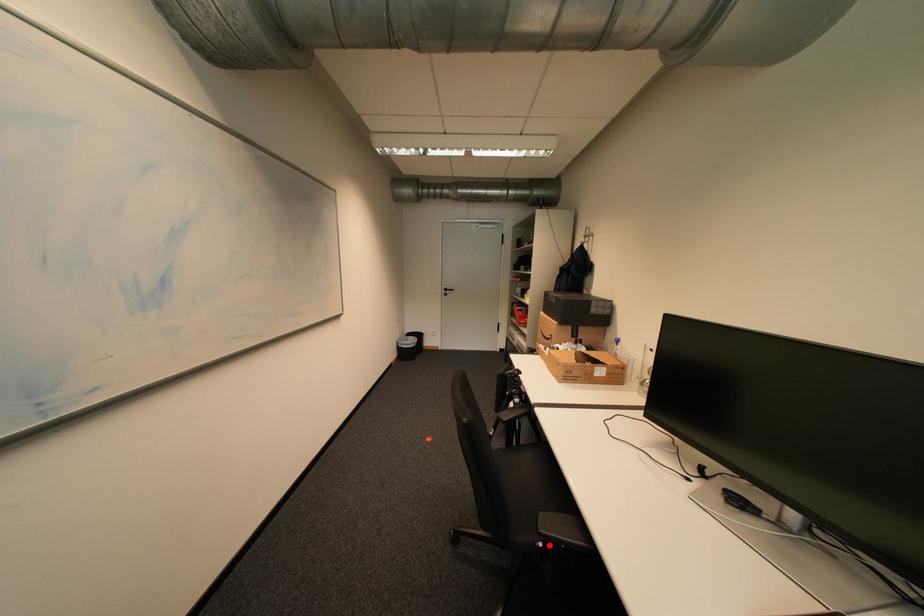
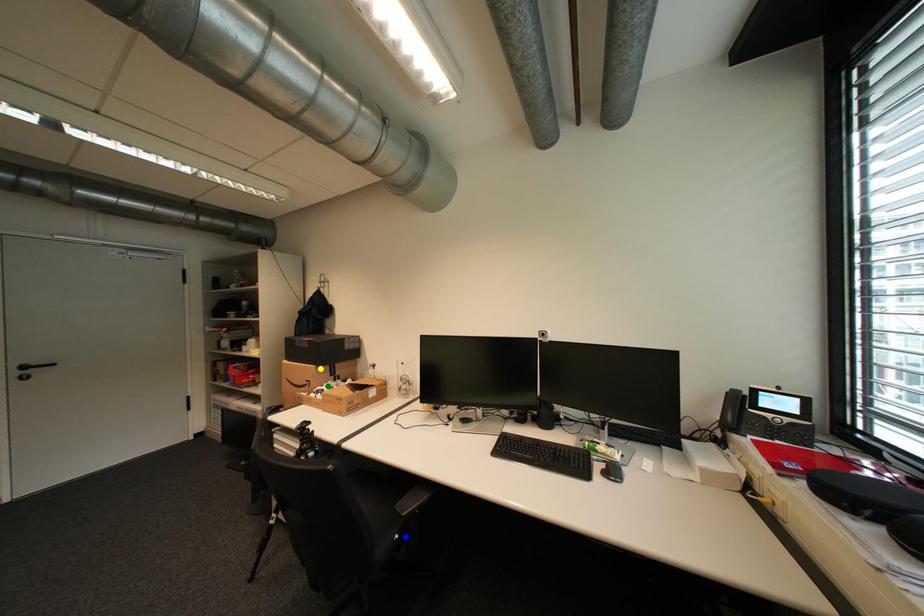
Question: I am providing you with two images of the same scene from different viewpoints. A red point is marked on the first image. You are given multiple points on the second image. Which point in image 2 is actually the same real-world point as the red point in image 1?

Choices:
 (A) green point
 (B) blue point
 (C) yellow point

Answer: (B)